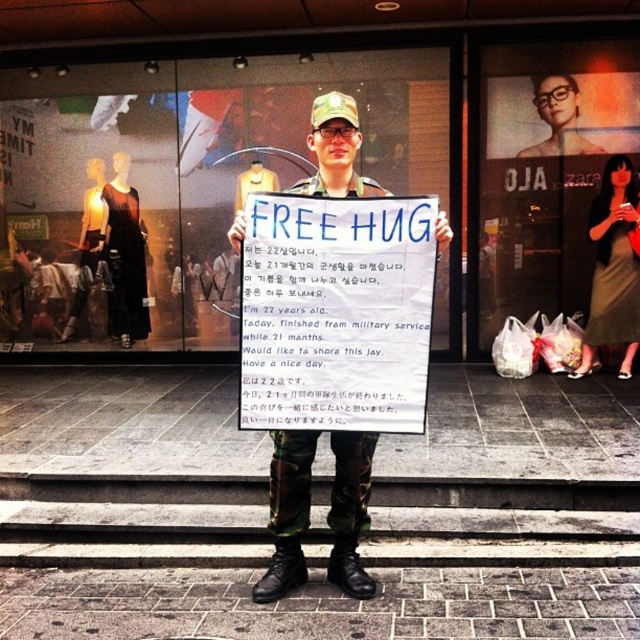
Can you confirm if camouflage fabric uniform at center is positioned below matte black military uniform at center?

Indeed, camouflage fabric uniform at center is positioned under matte black military uniform at center.

Find the location of a particular element. The height and width of the screenshot is (640, 640). camouflage fabric uniform at center is located at coordinates (288, 512).

Where is `camouflage fabric uniform at center`? camouflage fabric uniform at center is located at coordinates (288, 512).

The height and width of the screenshot is (640, 640). What do you see at coordinates (336, 312) in the screenshot?
I see `blue paper sign at center` at bounding box center [336, 312].

Can you confirm if blue paper sign at center is taller than matte black military uniform at center?

Yes.

Describe the element at coordinates (336, 312) in the screenshot. The height and width of the screenshot is (640, 640). I see `blue paper sign at center` at that location.

In order to click on blue paper sign at center in this screenshot , I will do `click(336, 312)`.

Which of these two, glass display at center or matte black military uniform at center, stands taller?

With more height is glass display at center.

Which is in front, point (19, 93) or point (568, 150)?

Point (568, 150)

This screenshot has width=640, height=640. What are the coordinates of `glass display at center` in the screenshot? It's located at (180, 182).

Image resolution: width=640 pixels, height=640 pixels. In order to click on glass display at center in this screenshot , I will do `click(180, 182)`.